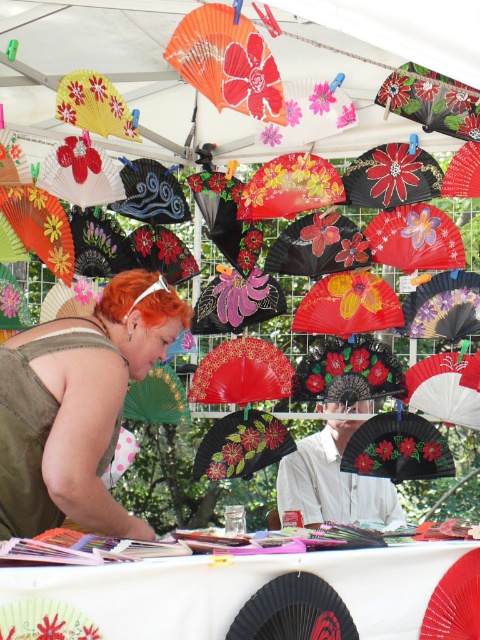
Who is more forward, (x=149, y=337) or (x=325, y=454)?

Point (x=149, y=337) is more forward.

Is point (164, 314) farther from viewer compared to point (300, 461)?

No, (164, 314) is in front of (300, 461).

Which is behind, point (79, 442) or point (324, 352)?

The point (324, 352) is more distant.

Find the location of a particular element. The height and width of the screenshot is (640, 480). matte olive green tank top at center is located at coordinates (76, 406).

Is matte black fan at center to the left of orange paper fan at upper center from the viewer's perspective?

Incorrect, matte black fan at center is not on the left side of orange paper fan at upper center.

At what (x,y) coordinates should I click in order to perform the action: click on matte black fan at center. Please return your answer as a coordinate pair (x, y). Looking at the image, I should click on (333, 481).

Is point (208, 80) farther from camera compared to point (448, 467)?

No, it is in front of (448, 467).

Which is below, orange paper fan at upper center or black paper fan at center?

Positioned lower is black paper fan at center.

Is point (256, 74) more distant than point (411, 472)?

No, it is not.

Locate an element on the screen. orange paper fan at upper center is located at coordinates (228, 61).